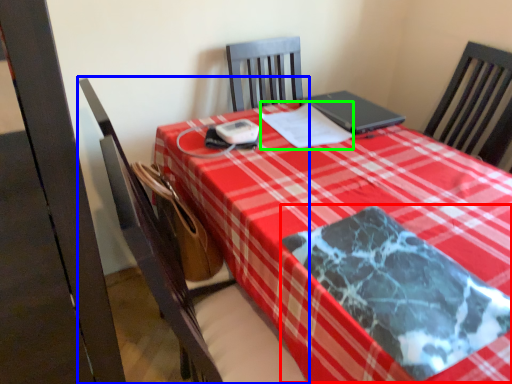
Question: Based on their relative distances, which object is farther from blanket (highlighted by a red box)? Choose from chair (highlighted by a blue box) and notebook (highlighted by a green box).

Choices:
 (A) chair
 (B) notebook

Answer: (B)